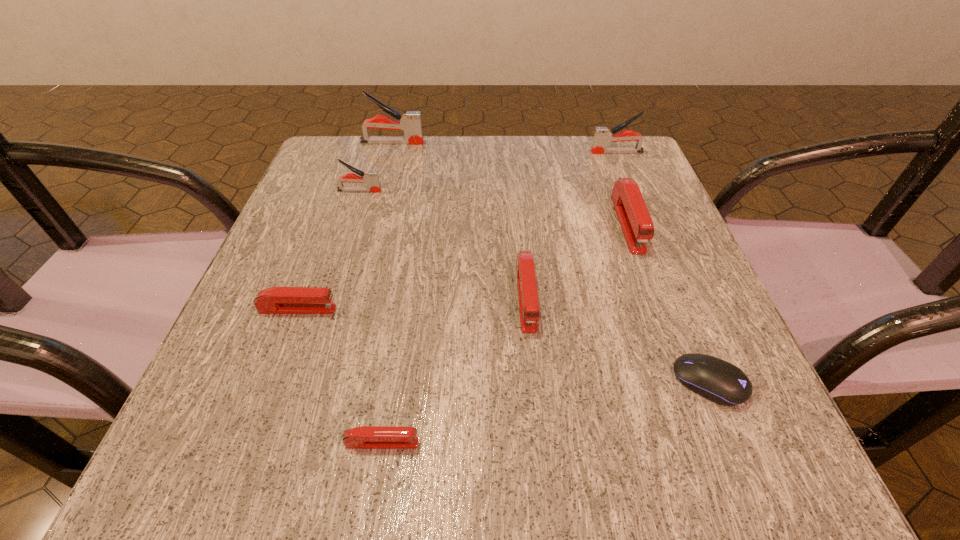
Image resolution: width=960 pixels, height=540 pixels. I want to click on blank space at the near edge of the desktop, so click(x=508, y=446).

In the image, there is a desktop. Where is `free space at the left edge`? The width and height of the screenshot is (960, 540). free space at the left edge is located at coordinates (293, 207).

This screenshot has height=540, width=960. Identify the location of vacant space at the right edge of the desktop. tap(677, 296).

Where is `vacant space at the far right corner of the desktop`? vacant space at the far right corner of the desktop is located at coordinates (629, 162).

Where is `vacant space at the near right corner of the desktop`? The width and height of the screenshot is (960, 540). vacant space at the near right corner of the desktop is located at coordinates (779, 427).

What are the coordinates of `free space between the nearest stapler and the tallest object` in the screenshot? It's located at (387, 293).

The height and width of the screenshot is (540, 960). Find the location of `blank region between the fourth farthest stapler and the second smallest red stapler`. blank region between the fourth farthest stapler and the second smallest red stapler is located at coordinates (463, 266).

Where is `free space that is in between the farthest stapler and the nearest gray stapler`? The image size is (960, 540). free space that is in between the farthest stapler and the nearest gray stapler is located at coordinates (375, 167).

Find the location of a particular element. This screenshot has width=960, height=540. empty location between the black computer mouse and the third shortest object is located at coordinates (503, 346).

At what (x,y) coordinates should I click in order to perform the action: click on vacant space that's between the third biggest red stapler and the second farthest gray stapler. Please return your answer as a coordinate pair (x, y). Looking at the image, I should click on (457, 231).